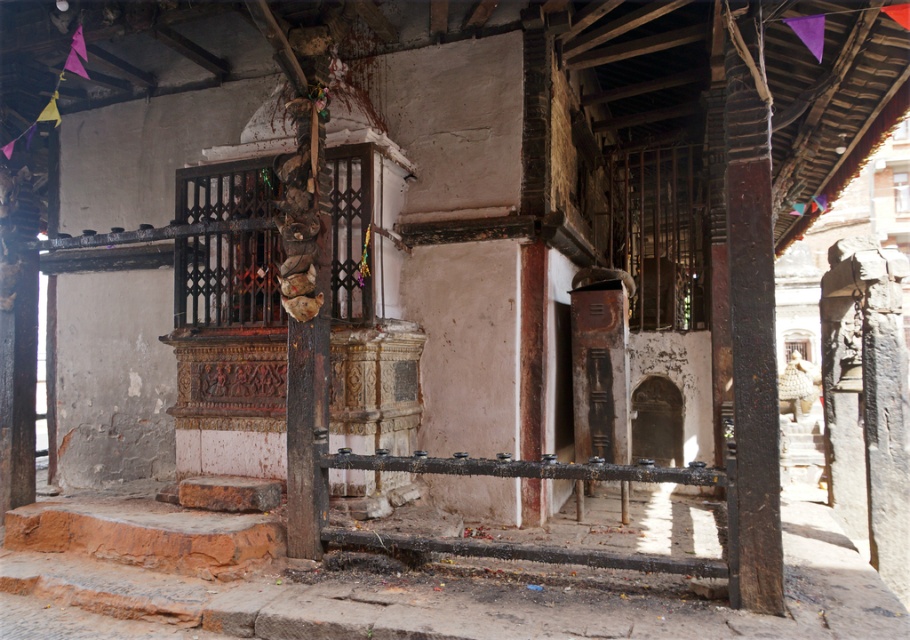
Which is behind, point (728, 80) or point (503, 474)?

The point (503, 474) is more distant.

Which of these two, brown rough wood pillar at right or rusty metal rail at center, stands taller?

brown rough wood pillar at right

What do you see at coordinates (751, 324) in the screenshot?
I see `brown rough wood pillar at right` at bounding box center [751, 324].

Where is `brown rough wood pillar at right`? The height and width of the screenshot is (640, 910). brown rough wood pillar at right is located at coordinates (751, 324).